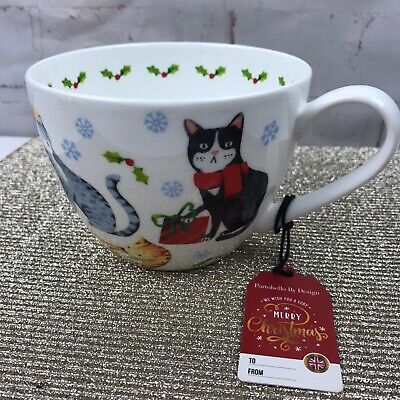
Identify the location of 1 tea cup. This screenshot has width=400, height=400. (172, 149).